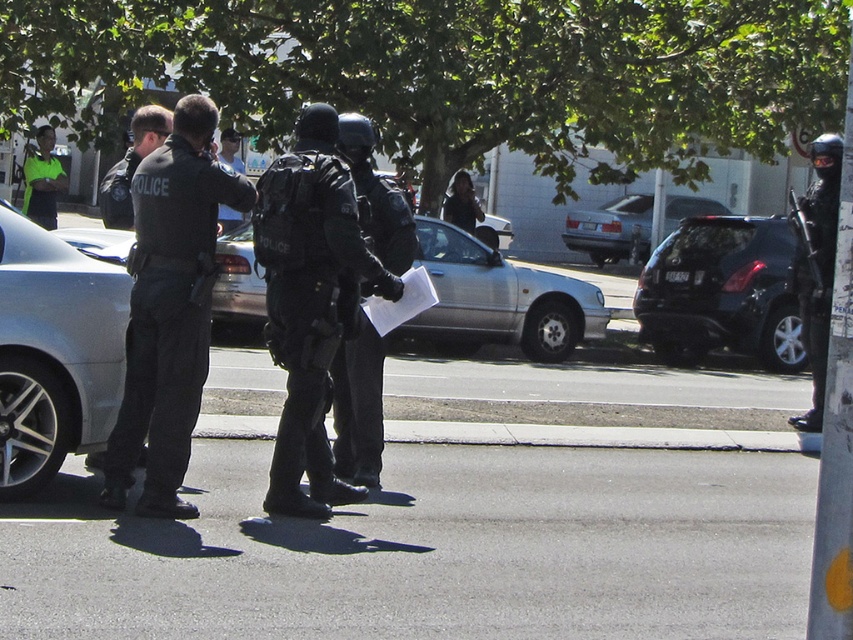
Is point (769, 342) more distant than point (234, 266)?

Yes, point (769, 342) is farther from viewer.

Does point (711, 291) come in front of point (222, 308)?

No.

At what (x,y) coordinates should I click in order to perform the action: click on black matte car at right. Please return your answer as a coordinate pair (x, y). Looking at the image, I should click on (722, 292).

Which is behind, point (335, 280) or point (219, 298)?

The point (219, 298) is more distant.

The image size is (853, 640). I want to click on black tactical gear at center, so click(310, 301).

Image resolution: width=853 pixels, height=640 pixels. What do you see at coordinates (310, 301) in the screenshot?
I see `black tactical gear at center` at bounding box center [310, 301].

Find the location of `black tactical gear at center`. black tactical gear at center is located at coordinates (310, 301).

Can you confirm if dark gray uniform at center is positioned below black matte car at right?

Correct, dark gray uniform at center is located below black matte car at right.

Can you confirm if dark gray uniform at center is taller than black matte car at right?

Yes.

In order to click on dark gray uniform at center in this screenshot , I will do `click(169, 307)`.